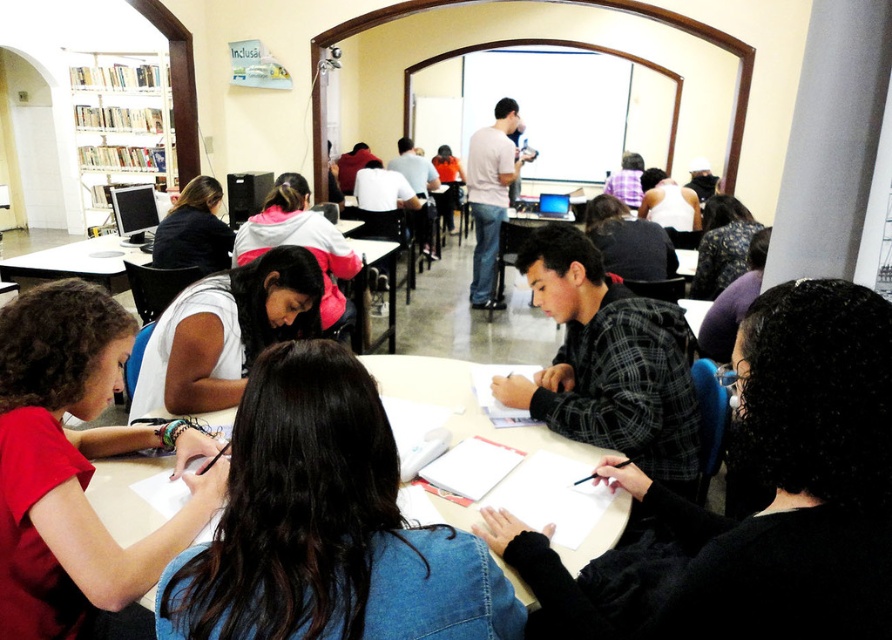
Does matte red shirt at lower left have a lesser width compared to white matte shirt at center?

Yes.

Is matte red shirt at lower left further to the viewer compared to white matte shirt at center?

No, matte red shirt at lower left is in front of white matte shirt at center.

Between point (121, 346) and point (245, 332), which one is positioned behind?

The point (245, 332) is behind.

This screenshot has height=640, width=892. What are the coordinates of `matte red shirt at lower left` in the screenshot? It's located at (73, 465).

Which is in front, point (42, 291) or point (122, 179)?

Positioned in front is point (42, 291).

In the scene shown: Between matte red shirt at lower left and white plastic bookshelf at upper left, which one is positioned higher?

white plastic bookshelf at upper left is higher up.

Where is `matte red shirt at lower left`? The width and height of the screenshot is (892, 640). matte red shirt at lower left is located at coordinates (73, 465).

Can you confirm if white matte shirt at center is positioned to the left of white paper at center?

Correct, you'll find white matte shirt at center to the left of white paper at center.

Does white matte shirt at center have a lesser width compared to white paper at center?

Correct, white matte shirt at center's width is less than white paper at center's.

Find the location of a particular element. This screenshot has height=640, width=892. white matte shirt at center is located at coordinates (226, 332).

Locate an element on the screen. This screenshot has width=892, height=640. white matte shirt at center is located at coordinates (226, 332).